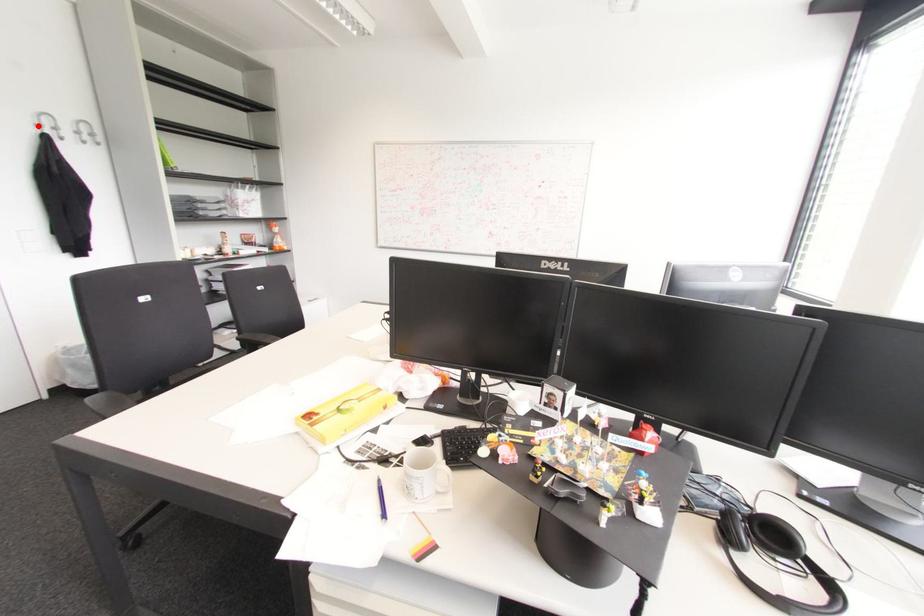
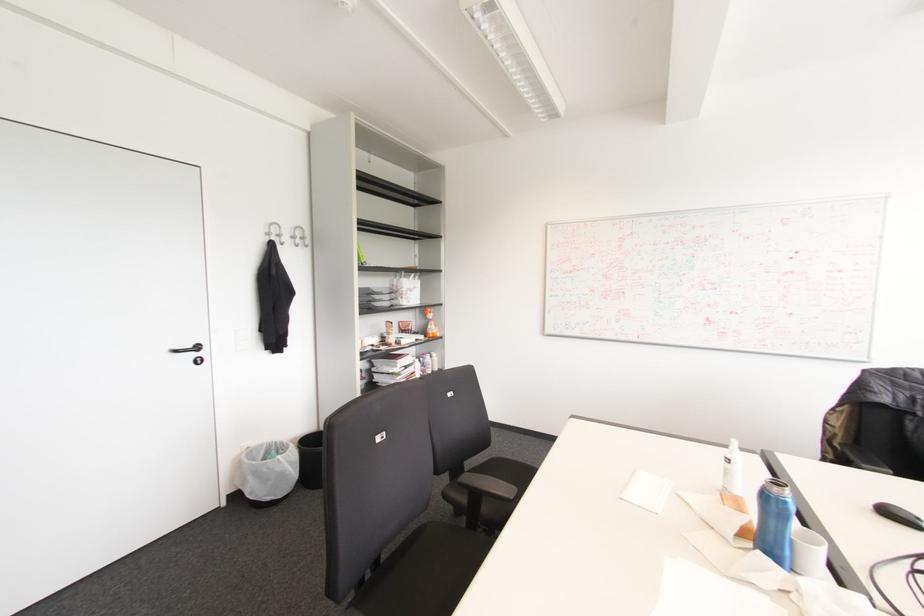
Locate, in the second image, the point that corresponds to the highlighted location in the first image.

(266, 233)